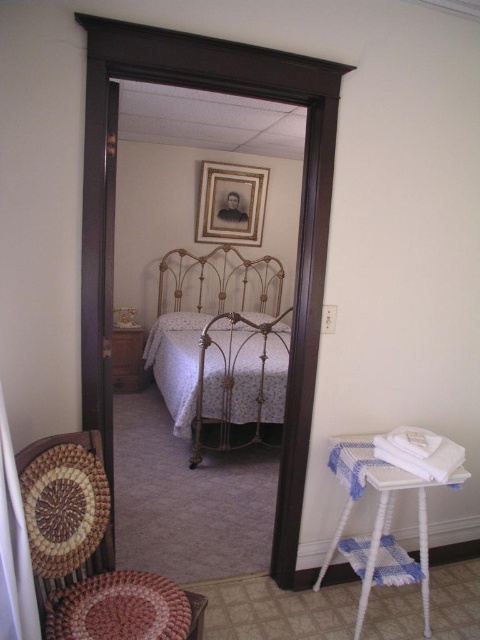
You are a delivery person holding a camera that is 0.5 meters wide. You need to place the camera next to the braided wood chair at lower left. Is there enough space between them for the camera?

The braided wood chair at lower left and camera are 1.26 meters apart, so yes, there is enough space between them for the camera since the distance is greater than the camera width of 0.5 meters.

You are standing in the doorway of the bedroom and see two points marked in the scene. Which point is closer to you, point (183, 177) or point (228, 410)?

Point (183, 177) is closer to you because it is further to the viewer than point (228, 410).

You are a guest entering the bedroom through the doorway. You see a braided wood chair at lower left and a white woven stool at lower right. Which object is shorter?

The braided wood chair at lower left is not as tall as the white woven stool at lower right, so the braided wood chair at lower left is shorter.